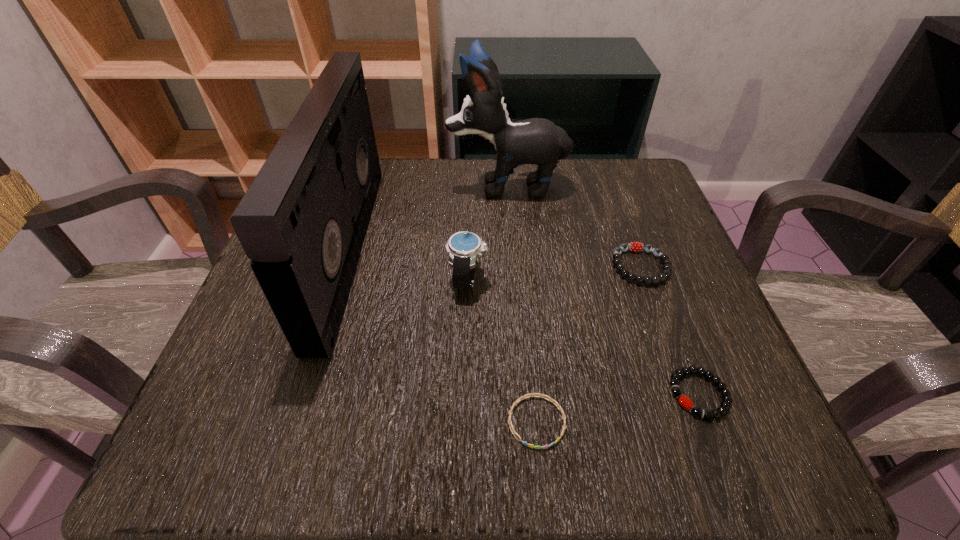
Locate an element on the screen. Image resolution: width=960 pixels, height=540 pixels. vacant space that satisfies the following two spatial constraints: 1. on the front-facing side of the puppy; 2. on the front side of the watch is located at coordinates 515,279.

The image size is (960, 540). Identify the location of free location that satisfies the following two spatial constraints: 1. on the front side of the second shortest bracelet; 2. on the left side of the tallest bracelet. (686, 394).

Where is `vacant space that satisfies the following two spatial constraints: 1. on the front side of the leftmost object; 2. on the back side of the watch`? The height and width of the screenshot is (540, 960). vacant space that satisfies the following two spatial constraints: 1. on the front side of the leftmost object; 2. on the back side of the watch is located at coordinates (340, 279).

This screenshot has width=960, height=540. What are the coordinates of `vacant position in the image that satisfies the following two spatial constraints: 1. on the front side of the third tallest object; 2. on the left side of the second shortest object` in the screenshot? It's located at (465, 394).

The height and width of the screenshot is (540, 960). What are the coordinates of `vacant area that satisfies the following two spatial constraints: 1. on the front-facing side of the third shortest object; 2. on the right side of the puppy` in the screenshot? It's located at (514, 266).

At what (x,y) coordinates should I click in order to perform the action: click on blank space that satisfies the following two spatial constraints: 1. on the front-facing side of the fifth tallest object; 2. on the right side of the puppy. Please return your answer as a coordinate pair (x, y). The height and width of the screenshot is (540, 960). Looking at the image, I should click on (523, 394).